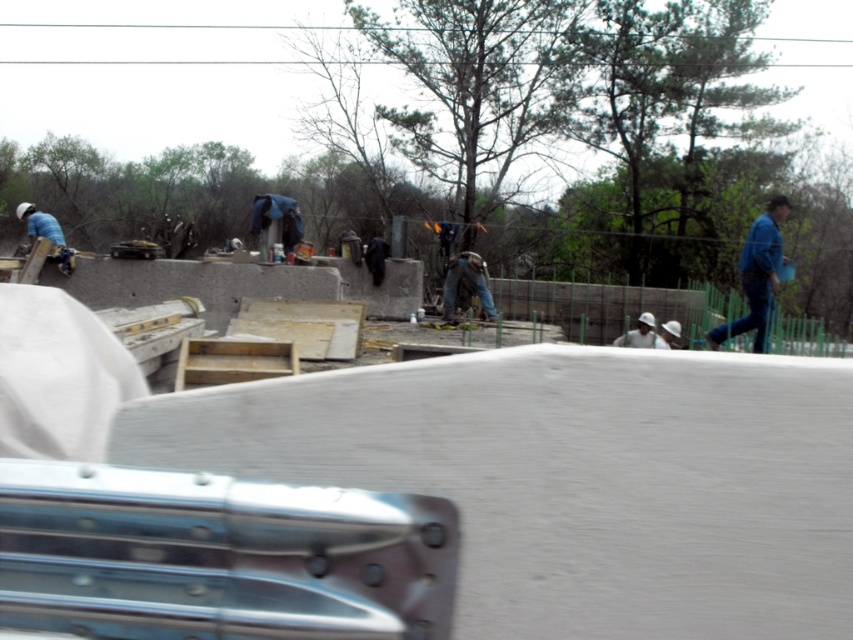
You are a construction worker who needs to move a heavy tool from the truck bed to the work area. The smooth concrete at center and blue denim jeans at right are in your path. Considering their widths, which object should you avoid stepping on to ensure stability?

The smooth concrete at center has a larger width than the blue denim jeans at right, so you should avoid stepping on the blue denim jeans at right as they are narrower and less stable for carrying heavy tools.

In the scene shown: You are a construction worker standing at the edge of the construction site. You need to place a 1.5 meter long safety barrier between yourself and the smooth concrete at center. Is the distance sufficient to place it there?

The smooth concrete at center is 1.49 meters from the camera, so the distance is insufficient to place a 1.5 meter long safety barrier between yourself and the smooth concrete at center.